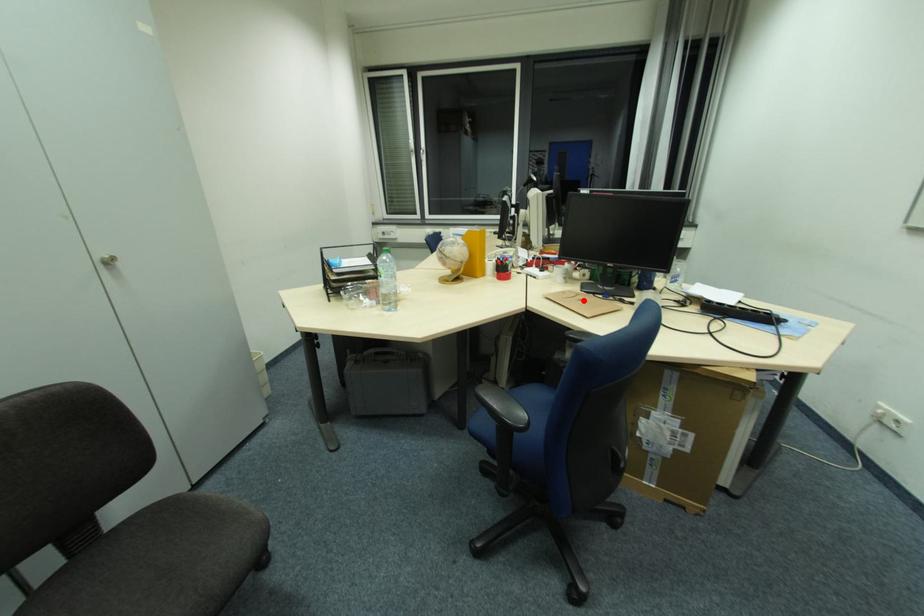
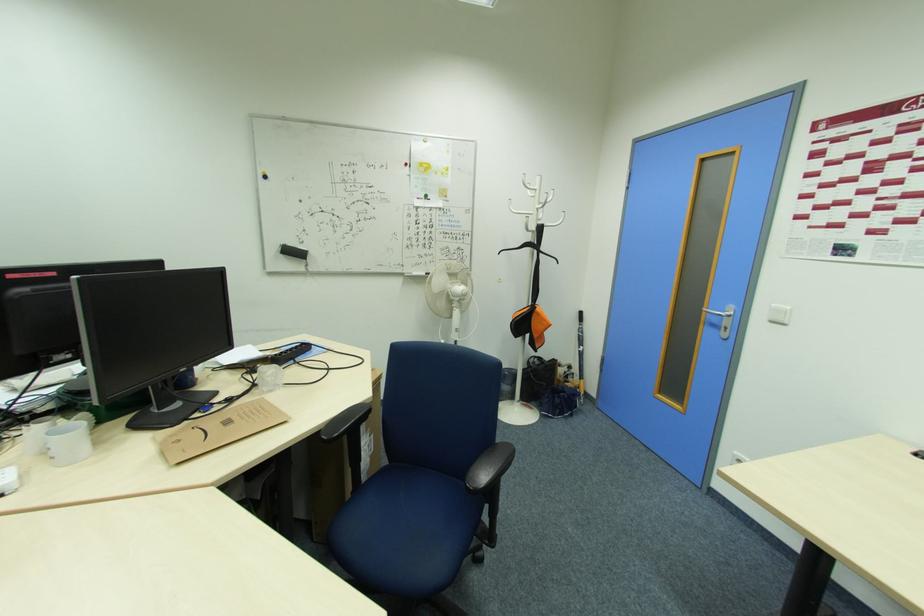
Find the pixel in the second image that matches the highlighted location in the first image.

(232, 424)